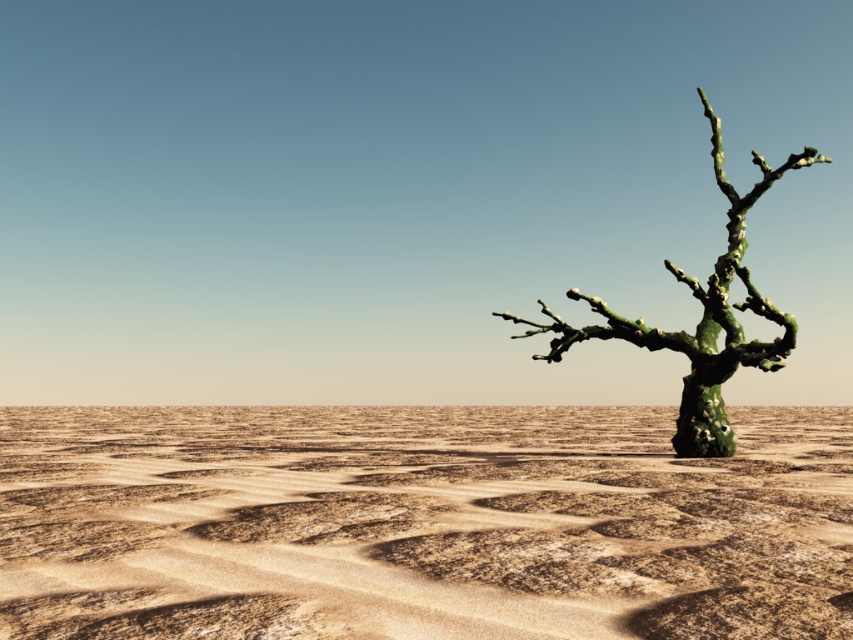
Is brown textured sand at center thinner than green mossy tree at right?

No.

Can you confirm if brown textured sand at center is positioned to the left of green mossy tree at right?

Indeed, brown textured sand at center is positioned on the left side of green mossy tree at right.

Which is in front, point (109, 506) or point (675, 422)?

Positioned in front is point (109, 506).

The height and width of the screenshot is (640, 853). I want to click on brown textured sand at center, so click(421, 524).